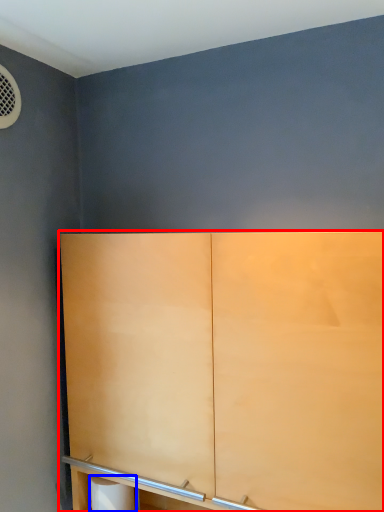
Question: Which point is further to the camera, cupboard (highlighted by a red box) or toilet paper (highlighted by a blue box)?

Choices:
 (A) cupboard
 (B) toilet paper

Answer: (B)